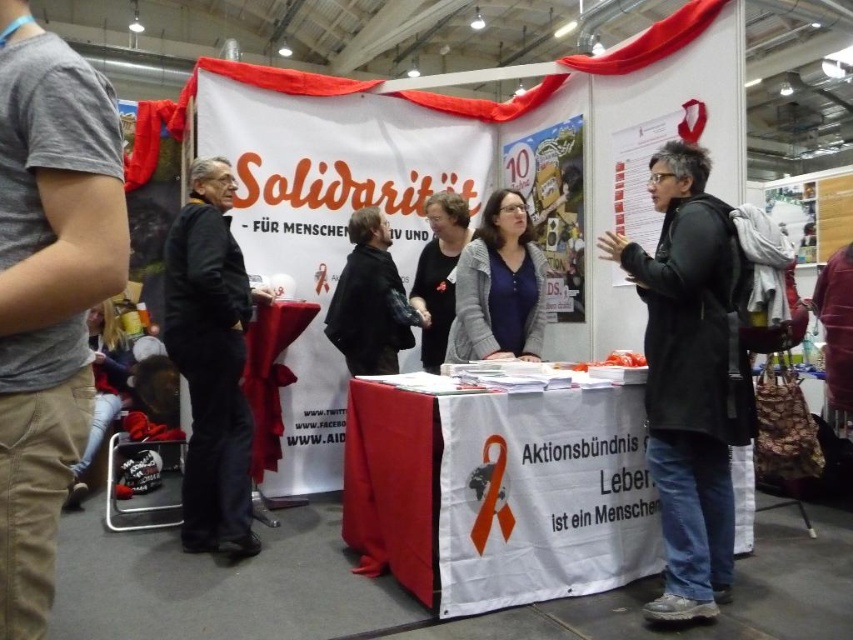
Who is more forward, (x=24, y=618) or (x=165, y=310)?

Point (x=24, y=618)

Who is more distant from viewer, (25, 195) or (177, 227)?

Point (177, 227)

Between point (67, 397) and point (228, 417), which one is positioned behind?

Positioned behind is point (228, 417).

Find the location of a particular element. gray cotton t-shirt at left is located at coordinates (48, 291).

Looking at this image, is black matte coat at center wider than dark gray sweater at center?

No, black matte coat at center is not wider than dark gray sweater at center.

In the scene shown: Between black matte coat at center and dark gray sweater at center, which one appears on the right side from the viewer's perspective?

black matte coat at center is more to the right.

This screenshot has height=640, width=853. Identify the location of black matte coat at center. (691, 376).

Image resolution: width=853 pixels, height=640 pixels. Find the location of `black matte coat at center`. black matte coat at center is located at coordinates (691, 376).

What do you see at coordinates (498, 285) in the screenshot?
I see `matte gray sweater at center` at bounding box center [498, 285].

Where is `matte gray sweater at center`? Image resolution: width=853 pixels, height=640 pixels. matte gray sweater at center is located at coordinates (498, 285).